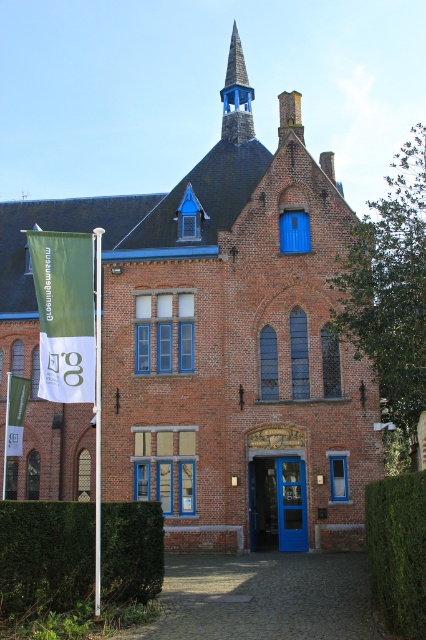
You are a delivery person trying to enter the building through the blue glass door at center. The delivery cart you are pushing is 1.2 meters wide. Can you fit through the door if the green fabric banner at left is hanging next to it?

The green fabric banner at left is wider than the blue glass door at center. Since the banner is wider, the door itself must be narrower than the banner. If the banner is wider than 1.2 meters, the door could still be narrower but potentially still wide enough for the cart. However, without knowing the banner width, we can only infer the door is narrower than the banner. To safely determine, measure the door width directly.

You are standing in front of the historic brick building and want to take a photo of the blue wooden spire at upper center. However, there is a green leafy hedge at lower left blocking your view. Can you determine which object is taller so you can adjust your camera angle accordingly?

The green leafy hedge at lower left is shorter than the blue wooden spire at upper center, so you can adjust your camera angle upwards to capture the spire without obstruction.